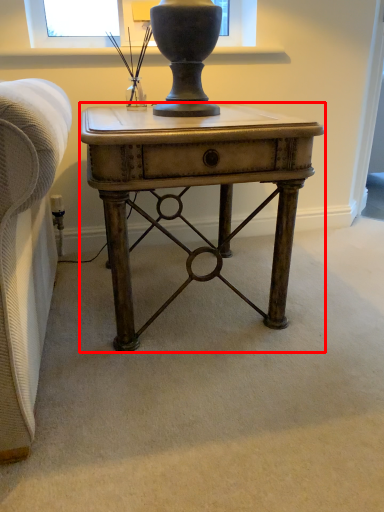
Question: Where is desk (annotated by the red box) located in relation to table lamp in the image?

Choices:
 (A) right
 (B) left

Answer: (A)